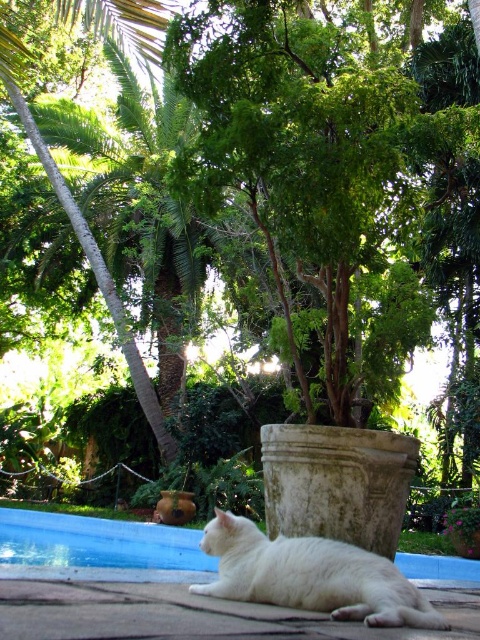
Find the location of a particular element. white fur cat at lower left is located at coordinates (311, 576).

Does white fur cat at lower left have a lesser height compared to blue smooth swimming pool at lower center?

Incorrect, white fur cat at lower left's height does not fall short of blue smooth swimming pool at lower center's.

Who is more distant from viewer, (251, 547) or (179, 545)?

The point (179, 545) is behind.

At what (x,y) coordinates should I click in order to perform the action: click on white fur cat at lower left. Please return your answer as a coordinate pair (x, y). This screenshot has height=640, width=480. Looking at the image, I should click on (311, 576).